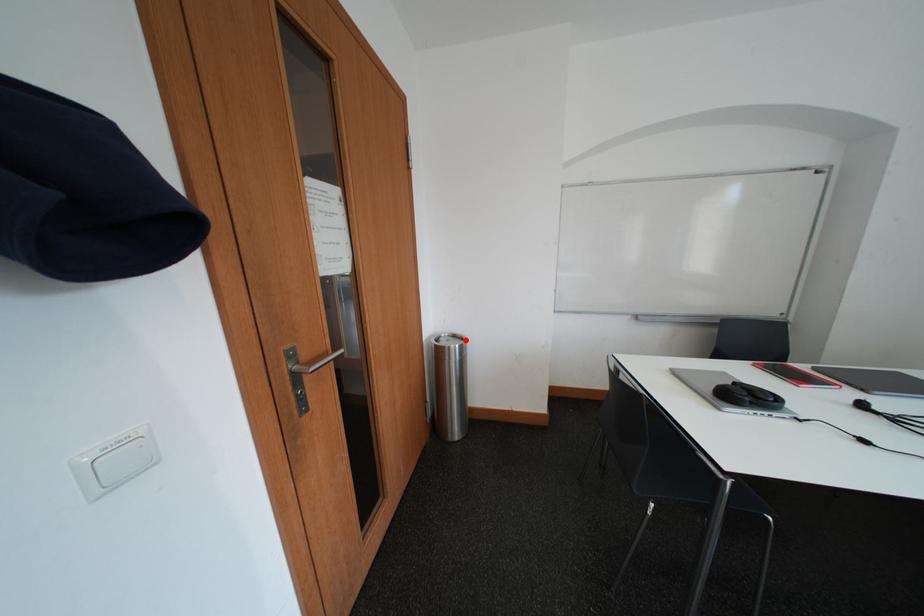
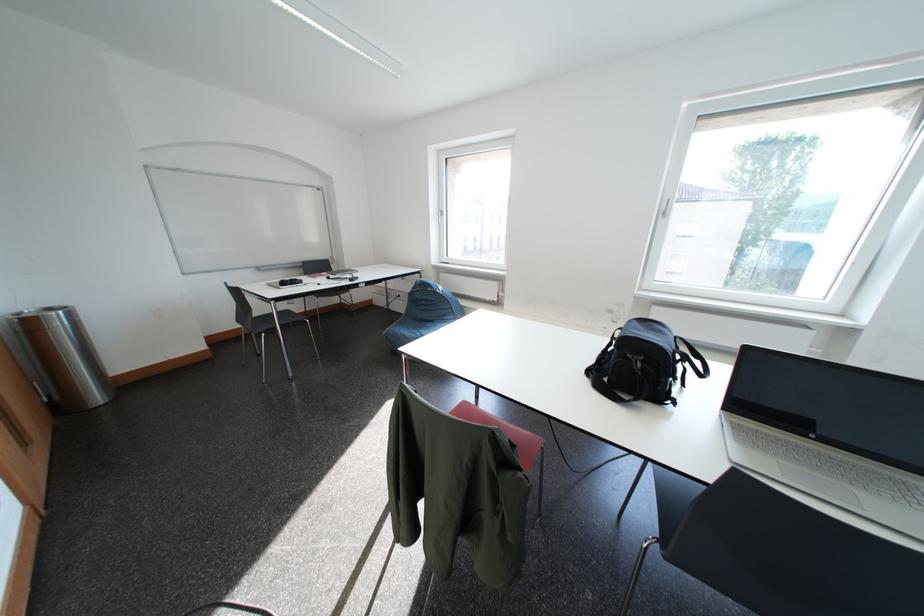
Find the pixel in the second image that matches the highlighted location in the first image.

(59, 312)